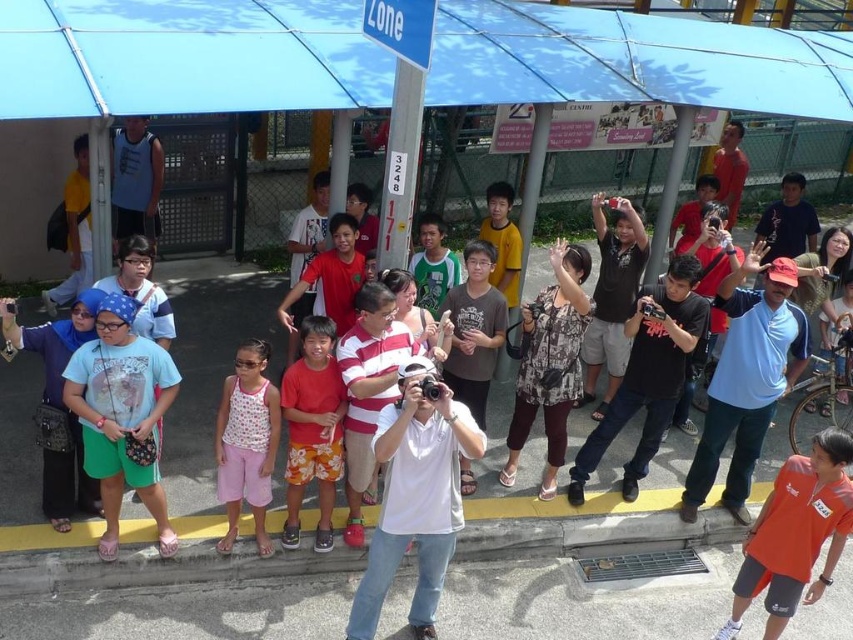
Who is more distant from viewer, (364, 586) or (241, 397)?

Point (241, 397)

Which of these two, white cotton camera at center or pink cotton shorts at center, stands shorter?

pink cotton shorts at center is shorter.

Is point (392, 568) closer to camera compared to point (264, 556)?

That is True.

Locate an element on the screen. The height and width of the screenshot is (640, 853). white cotton camera at center is located at coordinates (415, 497).

Based on the photo, which is more to the left, blue fabric canopy at upper center or pink cotton shorts at center?

From the viewer's perspective, blue fabric canopy at upper center appears more on the left side.

Does blue fabric canopy at upper center appear over pink cotton shorts at center?

Yes.

Where is `blue fabric canopy at upper center`? Image resolution: width=853 pixels, height=640 pixels. blue fabric canopy at upper center is located at coordinates (186, 56).

Which is in front, point (416, 365) or point (775, 592)?

Point (416, 365)

Which of these two, white cotton camera at center or orange jersey at center, stands shorter?

orange jersey at center is shorter.

Which is in front, point (451, 534) or point (837, 520)?

Point (837, 520) is more forward.

Locate an element on the screen. Image resolution: width=853 pixels, height=640 pixels. white cotton camera at center is located at coordinates (415, 497).